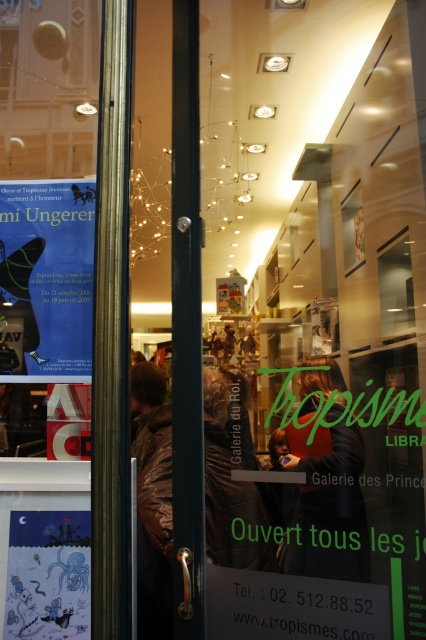
Is red fabric person at center taller than brown leather jacket at center?

Yes, red fabric person at center is taller than brown leather jacket at center.

Can you confirm if red fabric person at center is thinner than brown leather jacket at center?

Incorrect, red fabric person at center's width is not less than brown leather jacket at center's.

In order to click on red fabric person at center in this screenshot , I will do `click(328, 502)`.

Does matte paper poster at upper left come in front of matte blue octopus at lower left?

No, it is behind matte blue octopus at lower left.

Does matte paper poster at upper left have a smaller size compared to matte blue octopus at lower left?

No.

At what (x,y) coordinates should I click in order to perform the action: click on matte paper poster at upper left. Please return your answer as a coordinate pair (x, y). Looking at the image, I should click on (46, 278).

Which of these two, matte blue octopus at lower left or brown leather jacket at center, stands shorter?

Standing shorter between the two is matte blue octopus at lower left.

Does matte blue octopus at lower left have a greater width compared to brown leather jacket at center?

Yes, matte blue octopus at lower left is wider than brown leather jacket at center.

Does point (20, 557) come closer to viewer compared to point (261, 502)?

No, it is not.

Locate an element on the screen. The image size is (426, 640). matte blue octopus at lower left is located at coordinates (48, 576).